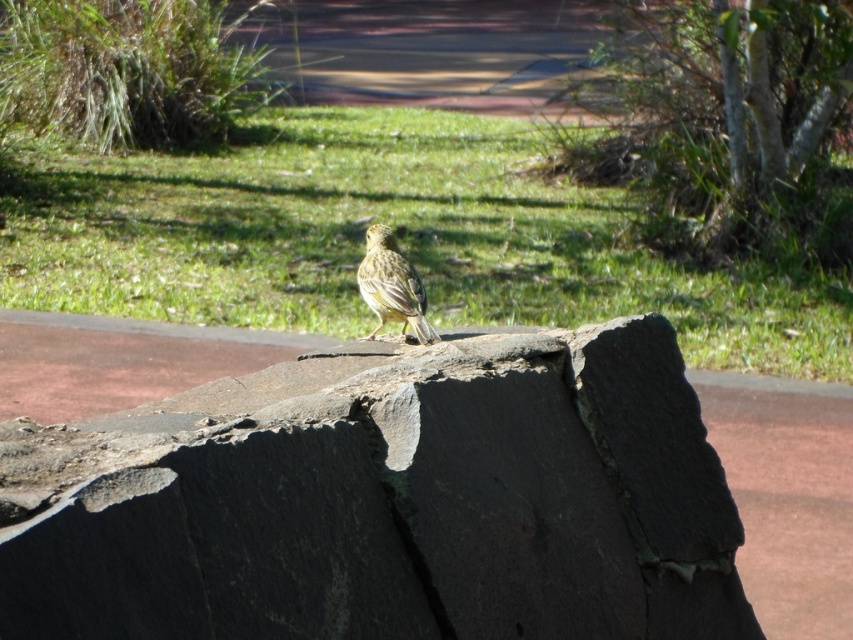
You are a photographer trying to capture a closeup of the yellow matte sparrow at center. Since the green grass at center is blocking your view, can you move the grass to the side to get a clear shot?

The green grass at center is larger in size than yellow matte sparrow at center, so moving the grass might not be feasible as it is bigger than the sparrow and could damage the grass or disturb the sparrow.

You are a gardener trying to place a small statue exactly between the green grass at center and the yellow matte sparrow at center. Which direction should you move from the sparrow to reach the grass?

The green grass at center is positioned on the left side of yellow matte sparrow at center, so you should move to the left from the sparrow to reach the grass.

Looking at this image, you are a park maintenance worker who needs to place a 1 meter long safety barrier between the dark gray stone boulder at center and the yellow matte sparrow at center. Based on the scene, will the barrier fit between them without overlapping either object?

The dark gray stone boulder at center and yellow matte sparrow at center are 94.54 centimeters apart. Since the barrier is 1 meter long, which is longer than the distance between them, the barrier will overlap both objects.